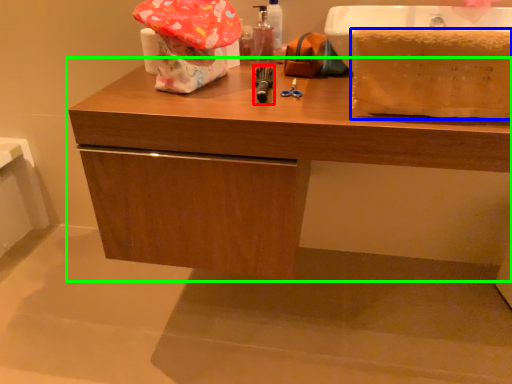
Question: Estimate the real-world distances between objects in this image. Which object is farther from tool (highlighted by a red box), blanket (highlighted by a blue box) or bathroom cabinet (highlighted by a green box)?

Choices:
 (A) blanket
 (B) bathroom cabinet

Answer: (A)